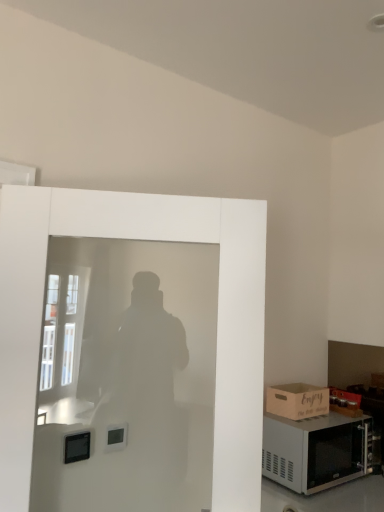
In the scene shown: In order to face white frosted glass screen door at left, should I rotate leftwards or rightwards?

You should rotate left by 8.444 degrees.

Image resolution: width=384 pixels, height=512 pixels. What are the coordinates of `white frosted glass screen door at left` in the screenshot? It's located at (128, 375).

Is white frosted glass screen door at left wider than brown cardboard box at lower right?

In fact, white frosted glass screen door at left might be narrower than brown cardboard box at lower right.

Is white frosted glass screen door at left positioned with its back to brown cardboard box at lower right?

No, white frosted glass screen door at left's orientation is not away from brown cardboard box at lower right.

Is white frosted glass screen door at left bigger than brown cardboard box at lower right?

Yes, white frosted glass screen door at left is bigger than brown cardboard box at lower right.

Where is `box on the right of white frosted glass screen door at left`? box on the right of white frosted glass screen door at left is located at coordinates (297, 401).

Does brown cardboard box at lower right appear on the right side of white frosted glass screen door at left?

Yes, brown cardboard box at lower right is to the right of white frosted glass screen door at left.

From the image's perspective, which object appears higher, brown cardboard box at lower right or white frosted glass screen door at left?

white frosted glass screen door at left appears higher in the image.

In terms of width, does brown cardboard box at lower right look wider or thinner when compared to white frosted glass screen door at left?

brown cardboard box at lower right is wider than white frosted glass screen door at left.

Which of these two, satin silver microwave at lower right or brown cardboard box at lower right, is thinner?

brown cardboard box at lower right.

From the image's perspective, which is below, satin silver microwave at lower right or brown cardboard box at lower right?

satin silver microwave at lower right appears lower in the image.

Is point (365, 463) positioned behind point (267, 393)?

No, it is not.

Can you confirm if white frosted glass screen door at left is shorter than satin silver microwave at lower right?

No, white frosted glass screen door at left is not shorter than satin silver microwave at lower right.

Does white frosted glass screen door at left have a larger size compared to satin silver microwave at lower right?

Yes.

Looking at their sizes, would you say white frosted glass screen door at left is wider or thinner than satin silver microwave at lower right?

white frosted glass screen door at left is thinner than satin silver microwave at lower right.

Can you see white frosted glass screen door at left touching satin silver microwave at lower right?

They are not placed beside each other.

Is brown cardboard box at lower right wider or thinner than satin silver microwave at lower right?

brown cardboard box at lower right is thinner than satin silver microwave at lower right.

From a real-world perspective, is brown cardboard box at lower right above or below satin silver microwave at lower right?

brown cardboard box at lower right is situated higher than satin silver microwave at lower right in the real world.

Can you tell me how much brown cardboard box at lower right and satin silver microwave at lower right differ in facing direction?

The angular difference between brown cardboard box at lower right and satin silver microwave at lower right is 7.51e-05 degrees.

Looking at this image, from the image's perspective, is brown cardboard box at lower right above or below satin silver microwave at lower right?

From the image's perspective, brown cardboard box at lower right appears above satin silver microwave at lower right.

Can you confirm if satin silver microwave at lower right is thinner than white frosted glass screen door at left?

Incorrect, the width of satin silver microwave at lower right is not less than that of white frosted glass screen door at left.

Could you tell me if satin silver microwave at lower right is facing white frosted glass screen door at left?

No, satin silver microwave at lower right does not turn towards white frosted glass screen door at left.

Is satin silver microwave at lower right at the left side of white frosted glass screen door at left?

Incorrect, satin silver microwave at lower right is not on the left side of white frosted glass screen door at left.

Looking at the image, does satin silver microwave at lower right seem bigger or smaller compared to white frosted glass screen door at left?

Clearly, satin silver microwave at lower right is smaller in size than white frosted glass screen door at left.

Locate an element on the screen. screen door that is on the left side of brown cardboard box at lower right is located at coordinates (128, 375).

There is a brown cardboard box at lower right. Where is `screen door above it (from a real-world perspective)`? This screenshot has width=384, height=512. screen door above it (from a real-world perspective) is located at coordinates (128, 375).

From the image, which object appears to be farther from brown cardboard box at lower right, white frosted glass screen door at left or satin silver microwave at lower right?

white frosted glass screen door at left is further to brown cardboard box at lower right.

When comparing their distances from satin silver microwave at lower right, does brown cardboard box at lower right or white frosted glass screen door at left seem closer?

Among the two, brown cardboard box at lower right is located nearer to satin silver microwave at lower right.

Estimate the real-world distances between objects in this image. Which object is further from brown cardboard box at lower right, satin silver microwave at lower right or white frosted glass screen door at left?

white frosted glass screen door at left is positioned further to the anchor brown cardboard box at lower right.

From the image, which object appears to be nearer to white frosted glass screen door at left, satin silver microwave at lower right or brown cardboard box at lower right?

satin silver microwave at lower right is closer to white frosted glass screen door at left.

Estimate the real-world distances between objects in this image. Which object is further from satin silver microwave at lower right, white frosted glass screen door at left or brown cardboard box at lower right?

white frosted glass screen door at left.

Consider the image. Which object lies nearer to the anchor point white frosted glass screen door at left, brown cardboard box at lower right or satin silver microwave at lower right?

satin silver microwave at lower right is positioned closer to the anchor white frosted glass screen door at left.

Find the location of a particular element. box situated between white frosted glass screen door at left and satin silver microwave at lower right from left to right is located at coordinates (297, 401).